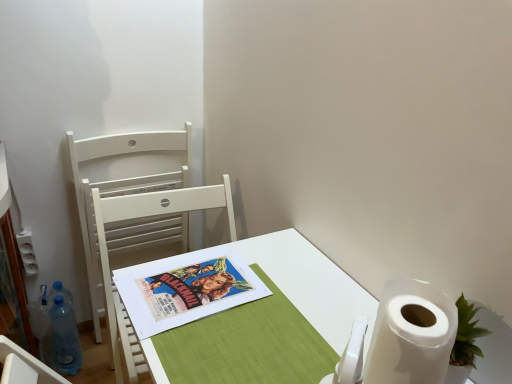
Describe the element at coordinates (65, 337) in the screenshot. I see `blue translucent bottle at lower left` at that location.

Measure the distance between blue translucent bottle at lower left and camera.

A distance of 4.85 feet exists between blue translucent bottle at lower left and camera.

What do you see at coordinates (27, 252) in the screenshot? This screenshot has width=512, height=384. I see `white plastic power outlet at left` at bounding box center [27, 252].

In order to face white wood chair at left, the 1th chair when ordered from front to back, should I rotate leftwards or rightwards?

You should look left and rotate roughly 9.688 degrees.

At what (x,y) coordinates should I click in order to perform the action: click on white paper at lower right. Please return your answer as a coordinate pair (x, y). Image resolution: width=512 pixels, height=384 pixels. Looking at the image, I should click on (411, 334).

Where is `white paper desk at center`? The width and height of the screenshot is (512, 384). white paper desk at center is located at coordinates (312, 284).

Find the location of a particular element. The height and width of the screenshot is (384, 512). colorful paper poster at center is located at coordinates (185, 288).

The width and height of the screenshot is (512, 384). What do you see at coordinates (185, 288) in the screenshot?
I see `colorful paper poster at center` at bounding box center [185, 288].

Where is `blue translucent bottle at lower left`? blue translucent bottle at lower left is located at coordinates (65, 337).

What's the angular difference between white wood chair at left, the 1th chair when ordered from front to back, and blue translucent bottle at lower left's facing directions?

The angular difference between white wood chair at left, the 1th chair when ordered from front to back, and blue translucent bottle at lower left is 0.0897 degrees.

From a real-world perspective, relative to blue translucent bottle at lower left, is white wood chair at left, the 2th chair positioned from the back, vertically above or below?

white wood chair at left, the 2th chair positioned from the back, is situated higher than blue translucent bottle at lower left in the real world.

From a real-world perspective, starting from the blue translucent bottle at lower left, which chair is the 1st one vertically above it? Please provide its 2D coordinates.

[(142, 217)]

From their relative heights in the image, would you say white wood chair at left, the 2th chair positioned from the back, is taller or shorter than blue translucent bottle at lower left?

white wood chair at left, the 2th chair positioned from the back, is taller than blue translucent bottle at lower left.

From their relative heights in the image, would you say blue translucent bottle at lower left is taller or shorter than white plastic power outlet at left?

Considering their sizes, blue translucent bottle at lower left has more height than white plastic power outlet at left.

Looking at this image, is blue translucent bottle at lower left looking in the opposite direction of white plastic power outlet at left?

No, blue translucent bottle at lower left's orientation is not away from white plastic power outlet at left.

Is blue translucent bottle at lower left outside of white plastic power outlet at left?

Yes.

Between white paper at lower right and white wood chair at left, which is the 1th chair in back-to-front order, which one is positioned behind?

Positioned behind is white wood chair at left, which is the 1th chair in back-to-front order.

Are white paper at lower right and white wood chair at left, which is the 1th chair in back-to-front order, beside each other?

white paper at lower right and white wood chair at left, which is the 1th chair in back-to-front order, are clearly separated.

Can you confirm if white paper at lower right is positioned to the right of white wood chair at left, which is the 1th chair in back-to-front order?

Yes, white paper at lower right is to the right of white wood chair at left, which is the 1th chair in back-to-front order.

In the scene shown: Between white paper at lower right and white wood chair at left, which ranks as the second chair in front-to-back order, which one has larger width?

With larger width is white paper at lower right.

Between colorful paper poster at center and white plastic power outlet at left, which one has more height?

white plastic power outlet at left is taller.

Is colorful paper poster at center thinner than white plastic power outlet at left?

Incorrect, the width of colorful paper poster at center is not less than that of white plastic power outlet at left.

From a real-world perspective, who is located lower, colorful paper poster at center or white plastic power outlet at left?

Result: From a 3D spatial view, white plastic power outlet at left is below.

Is white paper desk at center positioned far away from white plastic power outlet at left?

white paper desk at center is far away from white plastic power outlet at left.

Based on the photo, is white paper desk at center thinner than white plastic power outlet at left?

Incorrect, the width of white paper desk at center is not less than that of white plastic power outlet at left.

Which of these two, white paper desk at center or white plastic power outlet at left, stands taller?

With more height is white paper desk at center.

The image size is (512, 384). I want to click on comic book above the white paper desk at center (from a real-world perspective), so click(185, 288).

Considering the positions of objects white paper desk at center and colorful paper poster at center in the image provided, who is more to the right, white paper desk at center or colorful paper poster at center?

white paper desk at center.

Does white paper desk at center contain colorful paper poster at center?

Yes, colorful paper poster at center is surrounded by white paper desk at center.

Considering the sizes of white paper desk at center and colorful paper poster at center in the image, is white paper desk at center wider or thinner than colorful paper poster at center?

In the image, white paper desk at center appears to be wider than colorful paper poster at center.

From the image's perspective, which object appears higher, white paper desk at center or white wood chair at left, which is the 1th chair in back-to-front order?

white wood chair at left, which is the 1th chair in back-to-front order, is shown above in the image.

What's the angular difference between white paper desk at center and white wood chair at left, which ranks as the second chair in front-to-back order,'s facing directions?

There is a 90.2-degree angle between the facing directions of white paper desk at center and white wood chair at left, which ranks as the second chair in front-to-back order.

Does white paper desk at center have a smaller size compared to white wood chair at left, which is the 1th chair in back-to-front order?

Actually, white paper desk at center might be larger than white wood chair at left, which is the 1th chair in back-to-front order.

Locate an element on the screen. The width and height of the screenshot is (512, 384). bottle below the white wood chair at left, the 1th chair when ordered from front to back (from the image's perspective) is located at coordinates (65, 337).

Identify the location of power outlet located above the blue translucent bottle at lower left (from the image's perspective). (27, 252).

Considering their positions, is white wood chair at left, which is the 1th chair in back-to-front order, positioned further to white paper desk at center than colorful paper poster at center?

Based on the image, white wood chair at left, which is the 1th chair in back-to-front order, appears to be further to white paper desk at center.

Looking at the image, which one is located closer to blue translucent bottle at lower left, white wood chair at left, the 2th chair positioned from the back, or white paper at lower right?

The object closer to blue translucent bottle at lower left is white wood chair at left, the 2th chair positioned from the back.

Which object lies further to the anchor point white wood chair at left, the 2th chair positioned from the back, colorful paper poster at center or white paper desk at center?

white paper desk at center lies further to white wood chair at left, the 2th chair positioned from the back, than the other object.

When comparing their distances from colorful paper poster at center, does white paper desk at center or white wood chair at left, the 1th chair when ordered from front to back, seem further?

white wood chair at left, the 1th chair when ordered from front to back, is further to colorful paper poster at center.

From the image, which object appears to be farther from white wood chair at left, which is the 1th chair in back-to-front order, white paper at lower right or blue translucent bottle at lower left?

Based on the image, white paper at lower right appears to be further to white wood chair at left, which is the 1th chair in back-to-front order.

Estimate the real-world distances between objects in this image. Which object is further from white paper at lower right, white wood chair at left, which is the 1th chair in back-to-front order, or white plastic power outlet at left?

white plastic power outlet at left is further to white paper at lower right.

Consider the image. Which object lies further to the anchor point blue translucent bottle at lower left, white plastic power outlet at left or colorful paper poster at center?

colorful paper poster at center.

When comparing their distances from white plastic power outlet at left, does white paper desk at center or colorful paper poster at center seem further?

Based on the image, white paper desk at center appears to be further to white plastic power outlet at left.

Where is `comic book located between white paper desk at center and white wood chair at left, the 1th chair when ordered from front to back, in the depth direction`? This screenshot has width=512, height=384. comic book located between white paper desk at center and white wood chair at left, the 1th chair when ordered from front to back, in the depth direction is located at coordinates click(x=185, y=288).

Locate an element on the screen. Image resolution: width=512 pixels, height=384 pixels. bottle between white wood chair at left, the 1th chair when ordered from front to back, and white plastic power outlet at left from front to back is located at coordinates (65, 337).

At what (x,y) coordinates should I click in order to perform the action: click on chair between white wood chair at left, the 1th chair when ordered from front to back, and white plastic power outlet at left, along the z-axis. Please return your answer as a coordinate pair (x, y). Image resolution: width=512 pixels, height=384 pixels. Looking at the image, I should click on (121, 186).

The image size is (512, 384). I want to click on desk between white wood chair at left, the 1th chair when ordered from front to back, and white paper at lower right from left to right, so click(312, 284).